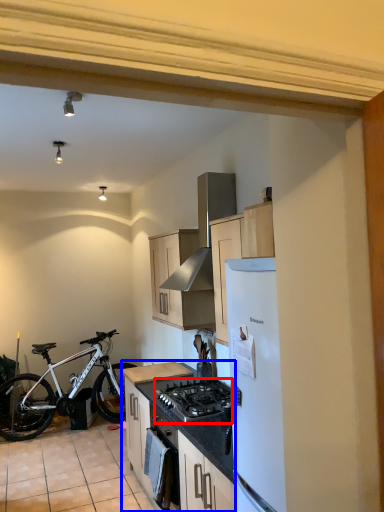
Question: Among these objects, which one is nearest to the camera, gas stove (highlighted by a red box) or cabinetry (highlighted by a blue box)?

Choices:
 (A) gas stove
 (B) cabinetry

Answer: (A)